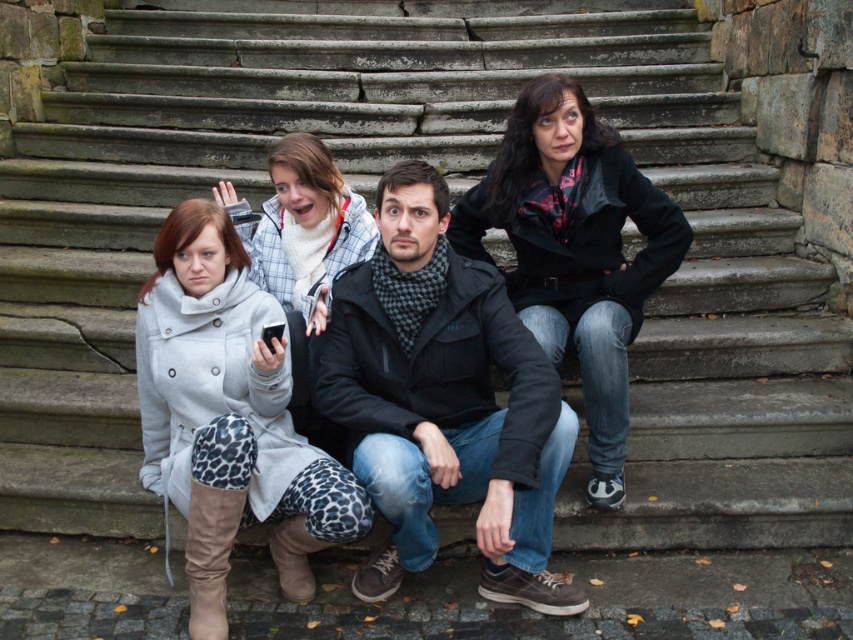
Is light gray wool coat at center taller than black leather jacket at center?

No, light gray wool coat at center is not taller than black leather jacket at center.

At what (x,y) coordinates should I click in order to perform the action: click on light gray wool coat at center. Please return your answer as a coordinate pair (x, y). The width and height of the screenshot is (853, 640). Looking at the image, I should click on coord(229,417).

You are a GUI agent. You are given a task and a screenshot of the screen. Output one action in this format:
    pyautogui.click(x=<x>, y=<y>)
    Task: Click on the light gray wool coat at center
    This screenshot has height=640, width=853.
    Given the screenshot: What is the action you would take?
    pyautogui.click(x=229, y=417)

Find the location of a particular element. light gray wool coat at center is located at coordinates (229, 417).

Is the position of dark gray matte jacket at center more distant than that of light gray wool coat at center?

No, dark gray matte jacket at center is closer to the viewer.

Does dark gray matte jacket at center have a greater width compared to light gray wool coat at center?

Yes.

In order to click on dark gray matte jacket at center in this screenshot , I will do `click(444, 401)`.

Is black leather jacket at center below white fleece jacket at center?

No, black leather jacket at center is not below white fleece jacket at center.

Does point (579, 268) come closer to viewer compared to point (321, 230)?

Yes, it is.

What do you see at coordinates (575, 250) in the screenshot?
I see `black leather jacket at center` at bounding box center [575, 250].

You are a GUI agent. You are given a task and a screenshot of the screen. Output one action in this format:
    pyautogui.click(x=<x>, y=<y>)
    Task: Click on the black leather jacket at center
    This screenshot has height=640, width=853.
    Given the screenshot: What is the action you would take?
    pyautogui.click(x=575, y=250)